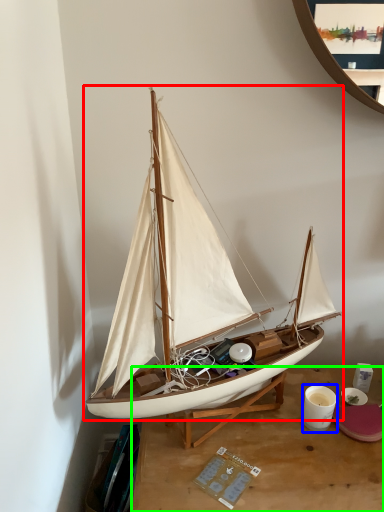
Question: Based on their relative distances, which object is nearer to boat (highlighted by a red box)? Choose from coffee cup (highlighted by a blue box) and desk (highlighted by a green box).

Choices:
 (A) coffee cup
 (B) desk

Answer: (B)